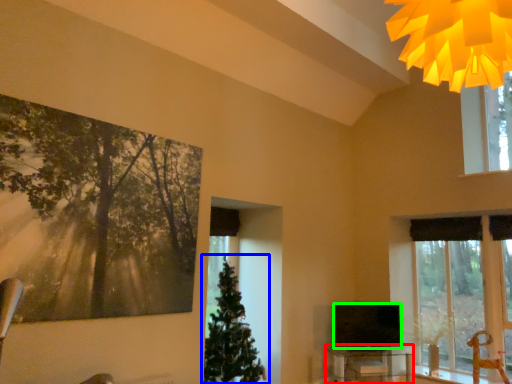
Question: Estimate the real-world distances between objects in this image. Which object is farther from table (highlighted by a red box), christmas tree (highlighted by a blue box) or television (highlighted by a green box)?

Choices:
 (A) christmas tree
 (B) television

Answer: (A)